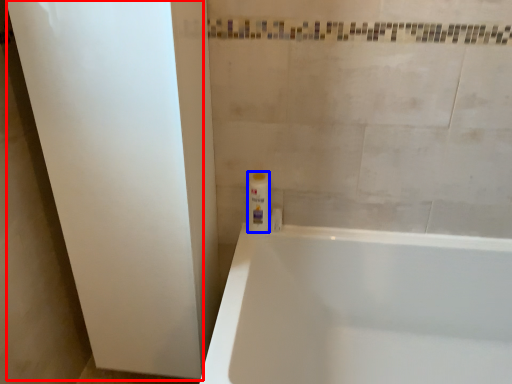
Question: Among these objects, which one is farthest to the camera, screen door (highlighted by a red box) or toiletry (highlighted by a blue box)?

Choices:
 (A) screen door
 (B) toiletry

Answer: (B)